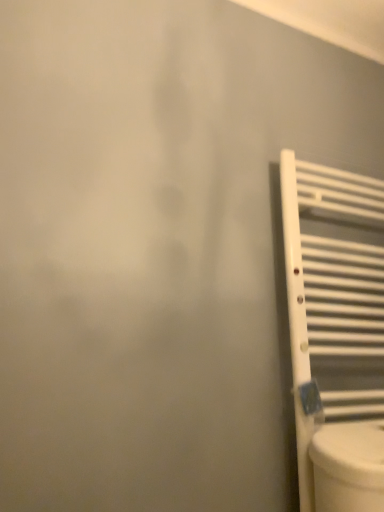
Question: From a real-world perspective, is white matte radiator at right above or below white glossy toilet at lower right?

Choices:
 (A) below
 (B) above

Answer: (B)

Question: Choose the correct answer: Is white matte radiator at right inside white glossy toilet at lower right or outside it?

Choices:
 (A) outside
 (B) inside

Answer: (A)

Question: In the image, is white matte radiator at right on the left side or the right side of white glossy toilet at lower right?

Choices:
 (A) left
 (B) right

Answer: (B)

Question: From the image's perspective, is white glossy toilet at lower right located above or below white matte radiator at right?

Choices:
 (A) below
 (B) above

Answer: (A)

Question: From a real-world perspective, is white glossy toilet at lower right above or below white matte radiator at right?

Choices:
 (A) above
 (B) below

Answer: (B)

Question: Looking at their shapes, would you say white glossy toilet at lower right is wider or thinner than white matte radiator at right?

Choices:
 (A) wide
 (B) thin

Answer: (A)

Question: Considering the positions of white glossy toilet at lower right and white matte radiator at right in the image, is white glossy toilet at lower right taller or shorter than white matte radiator at right?

Choices:
 (A) short
 (B) tall

Answer: (A)